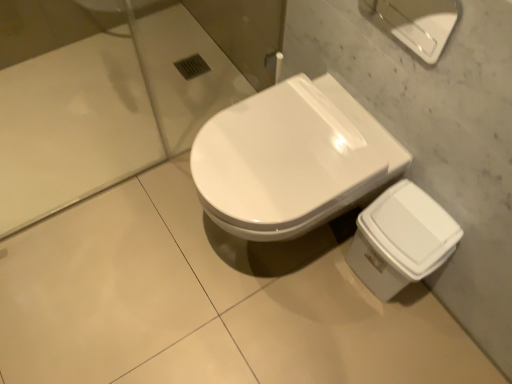
Question: Does white glossy porcelain at upper right, the first porcelain when ordered from top to bottom, have a greater height compared to white glossy trash can at lower right, the 1th porcelain from the bottom?

Choices:
 (A) yes
 (B) no

Answer: (B)

Question: Is white glossy porcelain at upper right, the first porcelain in the front-to-back sequence, at the left side of white glossy trash can at lower right, the 1th porcelain from the bottom?

Choices:
 (A) yes
 (B) no

Answer: (A)

Question: Can you confirm if white glossy porcelain at upper right, which is the second porcelain in back-to-front order, is smaller than white glossy trash can at lower right, which is the 2th porcelain in front-to-back order?

Choices:
 (A) no
 (B) yes

Answer: (B)

Question: From a real-world perspective, is white glossy porcelain at upper right, which is the second porcelain from bottom to top, beneath white glossy trash can at lower right, the 1th porcelain from the bottom?

Choices:
 (A) yes
 (B) no

Answer: (B)

Question: Is white glossy porcelain at upper right, which is the second porcelain from bottom to top, in front of white glossy trash can at lower right, the first porcelain positioned from the back?

Choices:
 (A) no
 (B) yes

Answer: (B)

Question: Does white glossy trash can at lower right, the 1th porcelain from the bottom, lie behind white glossy porcelain at upper right, which is the second porcelain in back-to-front order?

Choices:
 (A) yes
 (B) no

Answer: (A)

Question: Is white glossy trash can at lower right, the 1th porcelain from the bottom, facing away from white glossy porcelain at upper right, which is the second porcelain in back-to-front order?

Choices:
 (A) yes
 (B) no

Answer: (B)

Question: Is white glossy porcelain at upper right, which is the second porcelain in back-to-front order, surrounded by white glossy trash can at lower right, the first porcelain positioned from the back?

Choices:
 (A) no
 (B) yes

Answer: (A)

Question: Is white glossy trash can at lower right, the first porcelain positioned from the back, aimed at white glossy porcelain at upper right, which is the second porcelain from bottom to top?

Choices:
 (A) no
 (B) yes

Answer: (A)

Question: Considering the relative sizes of white glossy trash can at lower right, the first porcelain positioned from the back, and white glossy porcelain at upper right, which is the second porcelain from bottom to top, in the image provided, is white glossy trash can at lower right, the first porcelain positioned from the back, thinner than white glossy porcelain at upper right, which is the second porcelain from bottom to top,?

Choices:
 (A) no
 (B) yes

Answer: (A)

Question: From a real-world perspective, is white glossy trash can at lower right, which is the 2th porcelain in front-to-back order, on white glossy porcelain at upper right, which is the second porcelain in back-to-front order?

Choices:
 (A) no
 (B) yes

Answer: (A)

Question: Is white glossy toilet at center positioned with its back to white glossy trash can at lower right, the second porcelain viewed from the top?

Choices:
 (A) yes
 (B) no

Answer: (B)